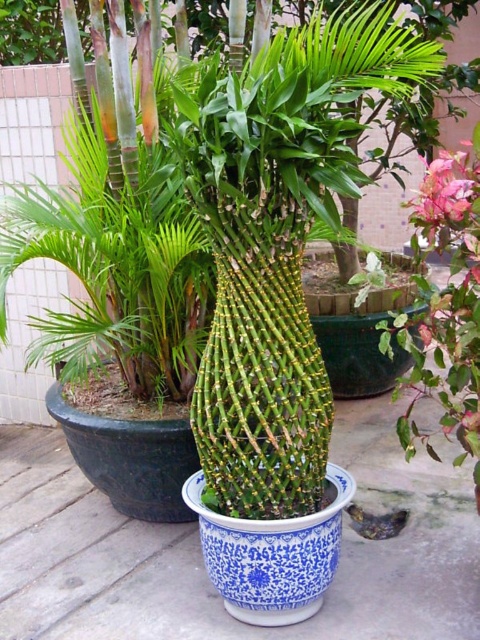
Which is above, blue porcelain vase at center or pink matte flower at upper right?

pink matte flower at upper right is higher up.

Describe the element at coordinates (272, 554) in the screenshot. I see `blue porcelain vase at center` at that location.

Measure the distance between blue porcelain vase at center and camera.

The distance of blue porcelain vase at center from camera is 7.36 feet.

In order to click on blue porcelain vase at center in this screenshot , I will do `click(272, 554)`.